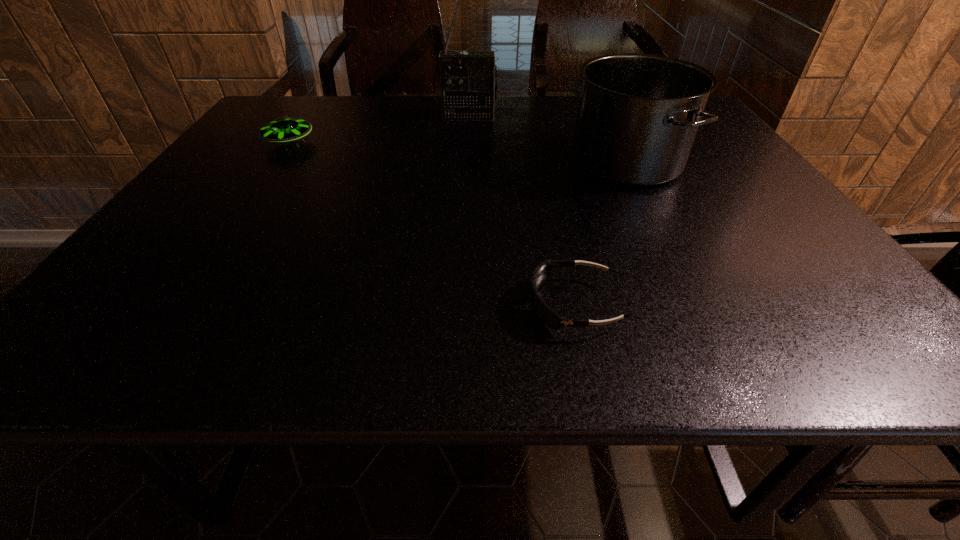
This screenshot has width=960, height=540. I want to click on the third object from right to left, so click(x=468, y=79).

This screenshot has width=960, height=540. What are the coordinates of `the tallest object` in the screenshot? It's located at (468, 79).

Where is `saucepan`? This screenshot has width=960, height=540. saucepan is located at coordinates (638, 114).

At what (x,y) coordinates should I click in order to perform the action: click on saucer. Please return your answer as a coordinate pair (x, y). This screenshot has height=540, width=960. Looking at the image, I should click on (283, 129).

The height and width of the screenshot is (540, 960). I want to click on the third tallest object, so click(x=283, y=129).

Identify the location of goggles. (546, 314).

Find the location of a particular element. The height and width of the screenshot is (540, 960). the shortest object is located at coordinates (546, 314).

The image size is (960, 540). What are the coordinates of `free region located on the display of the farthest object` in the screenshot? It's located at (467, 188).

Locate an element on the screen. The width and height of the screenshot is (960, 540). free space located on the front of the saucepan is located at coordinates (687, 287).

This screenshot has height=540, width=960. In order to click on free space located 0.120m on the right of the third tallest object in this screenshot , I will do `click(359, 143)`.